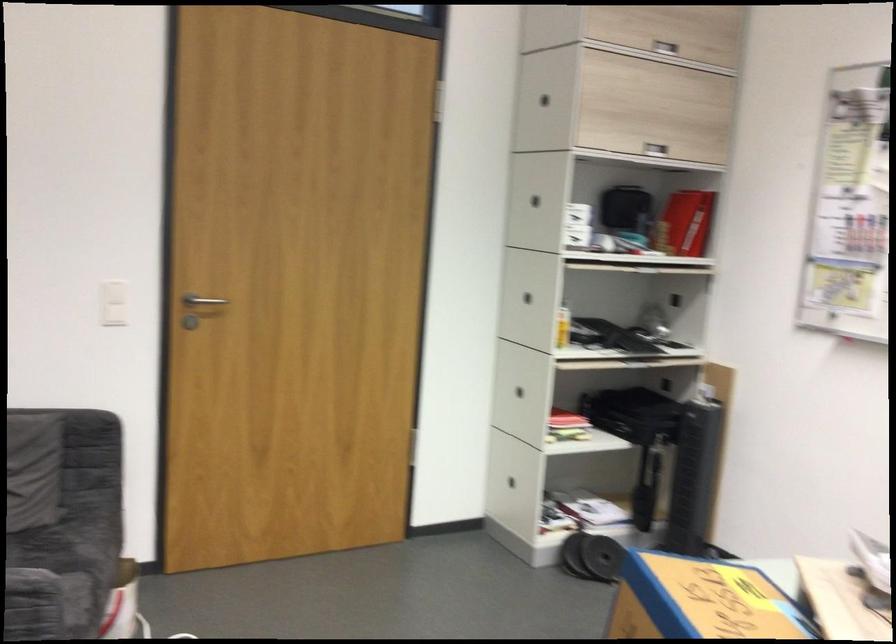
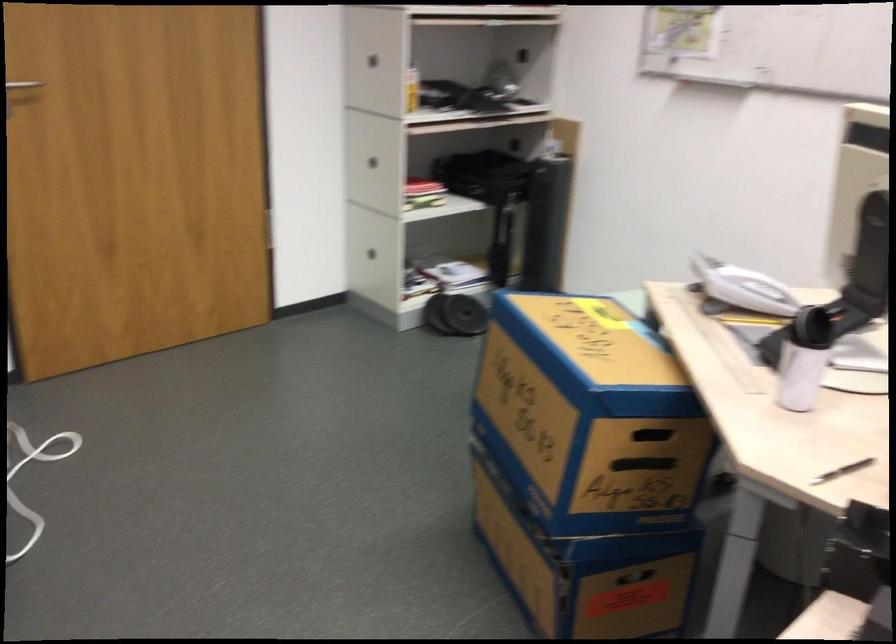
Question: How did the camera likely rotate?

Choices:
 (A) Left
 (B) Right
 (C) Up
 (D) Down

Answer: (D)